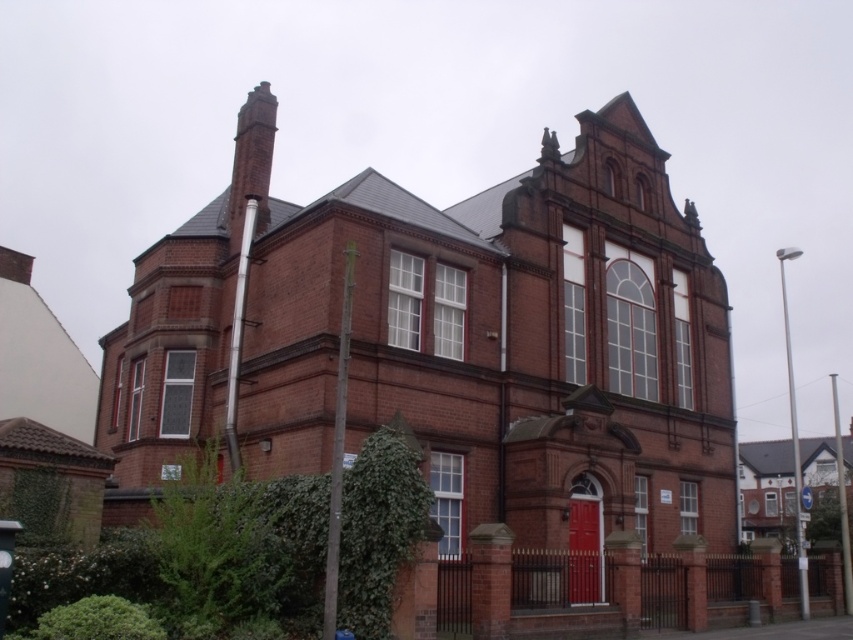
Is red brick church at center positioned in front of red brick chimney at upper left?

Yes, red brick church at center is closer to the viewer.

Is red brick church at center to the right of red brick chimney at upper left from the viewer's perspective?

Indeed, red brick church at center is positioned on the right side of red brick chimney at upper left.

Does point (302, 340) come farther from viewer compared to point (276, 115)?

That is False.

This screenshot has height=640, width=853. What are the coordinates of `red brick church at center` in the screenshot? It's located at (509, 344).